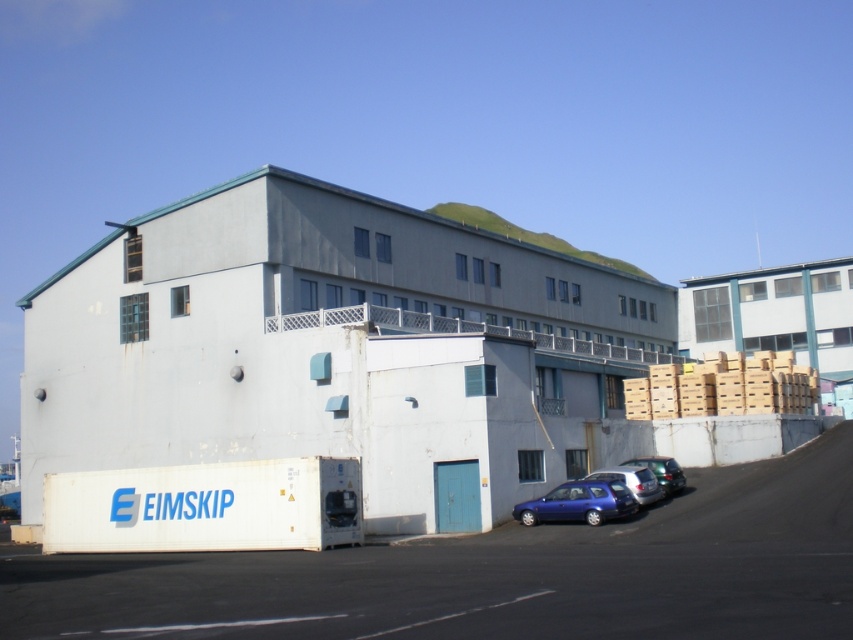
Is metallic blue hatchback at lower center below blue metallic car at center?

Correct, metallic blue hatchback at lower center is located below blue metallic car at center.

I want to click on metallic blue hatchback at lower center, so pos(579,502).

From the picture: Who is more forward, (587, 480) or (633, 480)?

Point (587, 480)

In order to click on metallic blue hatchback at lower center in this screenshot , I will do `click(579, 502)`.

Which is above, blue metallic car at center or metallic silver car at lower right?

Positioned higher is blue metallic car at center.

Can you confirm if blue metallic car at center is taller than metallic silver car at lower right?

Indeed, blue metallic car at center has a greater height compared to metallic silver car at lower right.

The width and height of the screenshot is (853, 640). Describe the element at coordinates (631, 481) in the screenshot. I see `blue metallic car at center` at that location.

The height and width of the screenshot is (640, 853). I want to click on blue metallic car at center, so click(631, 481).

Does point (602, 486) come farther from viewer compared to point (679, 488)?

No, (602, 486) is closer to viewer.

Is metallic blue hatchback at lower center further to the viewer compared to metallic silver car at lower right?

No.

Between point (621, 515) and point (656, 456), which one is positioned in front?

Point (621, 515) is more forward.

Identify the location of metallic blue hatchback at lower center. Image resolution: width=853 pixels, height=640 pixels. (579, 502).